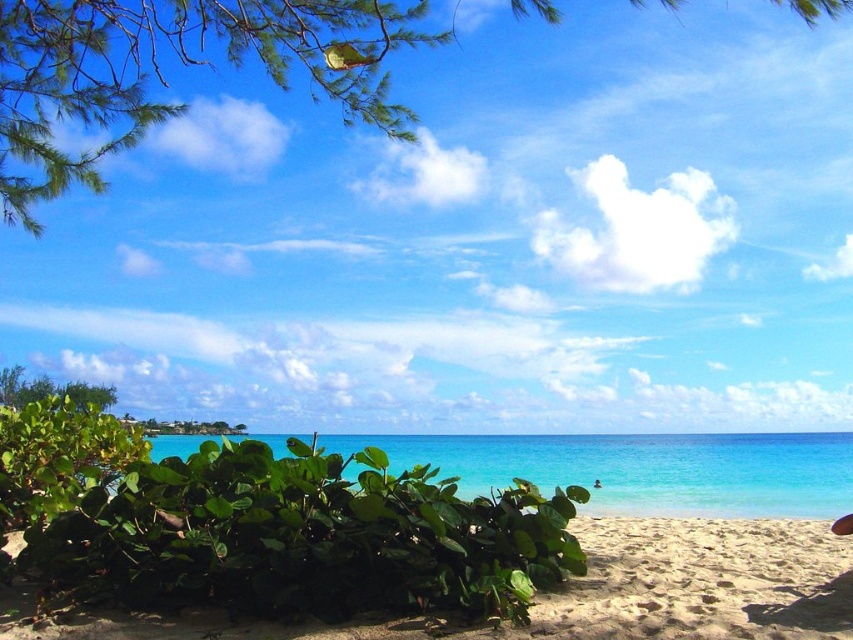
Question: Considering the relative positions of green leafy bush at center and sandy beach at lower right in the image provided, where is green leafy bush at center located with respect to sandy beach at lower right?

Choices:
 (A) below
 (B) above

Answer: (B)

Question: Which point is farther to the camera?

Choices:
 (A) (32, 637)
 (B) (708, 497)

Answer: (B)

Question: Can you confirm if sandy beach at lower right is positioned to the left of turquoise glossy water at center?

Choices:
 (A) no
 (B) yes

Answer: (A)

Question: Does green leafy bush at center have a greater width compared to sandy beach at lower right?

Choices:
 (A) yes
 (B) no

Answer: (B)

Question: Which of the following is the farthest from the observer?

Choices:
 (A) (131, 442)
 (B) (726, 579)
 (C) (612, 490)

Answer: (C)

Question: Which object appears farthest from the camera in this image?

Choices:
 (A) sandy beach at lower right
 (B) green leafy bush at center
 (C) turquoise glossy water at center

Answer: (C)